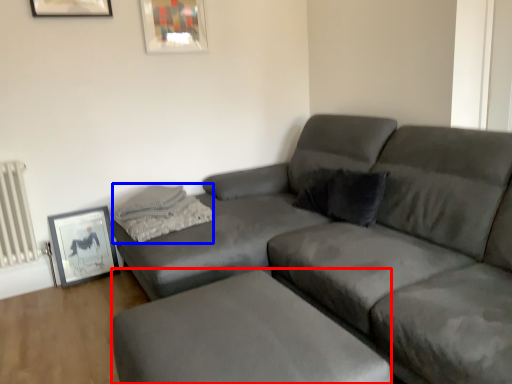
Question: Which of the following is the closest to the observer, footrest (highlighted by a red box) or pillow (highlighted by a blue box)?

Choices:
 (A) footrest
 (B) pillow

Answer: (A)